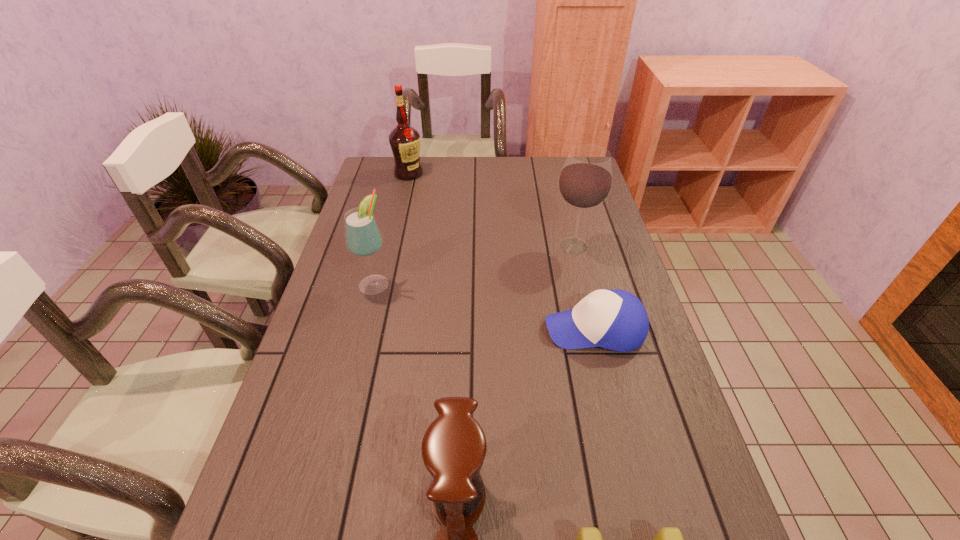
Identify the location of vacant region between the fourth nearest object and the farthest alcohol. The image size is (960, 540). (x=392, y=228).

Where is `vacant region between the second farthest object and the second shortest object`? The height and width of the screenshot is (540, 960). vacant region between the second farthest object and the second shortest object is located at coordinates (584, 288).

Where is `vacant area between the rightmost alcohol and the third nearest object`? The image size is (960, 540). vacant area between the rightmost alcohol and the third nearest object is located at coordinates click(584, 288).

Identify the location of vacant region between the second farthest alcohol and the third farthest object. The image size is (960, 540). 474,265.

The width and height of the screenshot is (960, 540). What are the coordinates of `the fourth closest object relative to the third farthest object` in the screenshot? It's located at (404, 140).

Where is `the second closest object relative to the rightmost alcohol`? Image resolution: width=960 pixels, height=540 pixels. the second closest object relative to the rightmost alcohol is located at coordinates (363, 238).

Select which alcohol appears as the closest to the farthest alcohol. Please provide its 2D coordinates. Your answer should be formatted as a tuple, i.e. [(x, y)], where the tuple contains the x and y coordinates of a point satisfying the conditions above.

[(363, 238)]

This screenshot has height=540, width=960. What are the coordinates of `alcohol object that ranks as the second closest to the second nearest alcohol` in the screenshot? It's located at (404, 140).